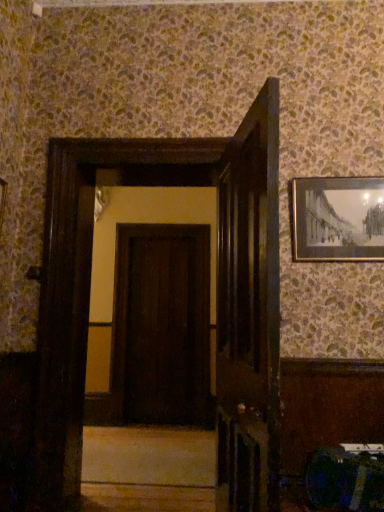
This screenshot has width=384, height=512. Find the location of `vacant area that is in front of dark brown wood door at center, positioned as the second door in front-to-back order`. vacant area that is in front of dark brown wood door at center, positioned as the second door in front-to-back order is located at coordinates (162, 433).